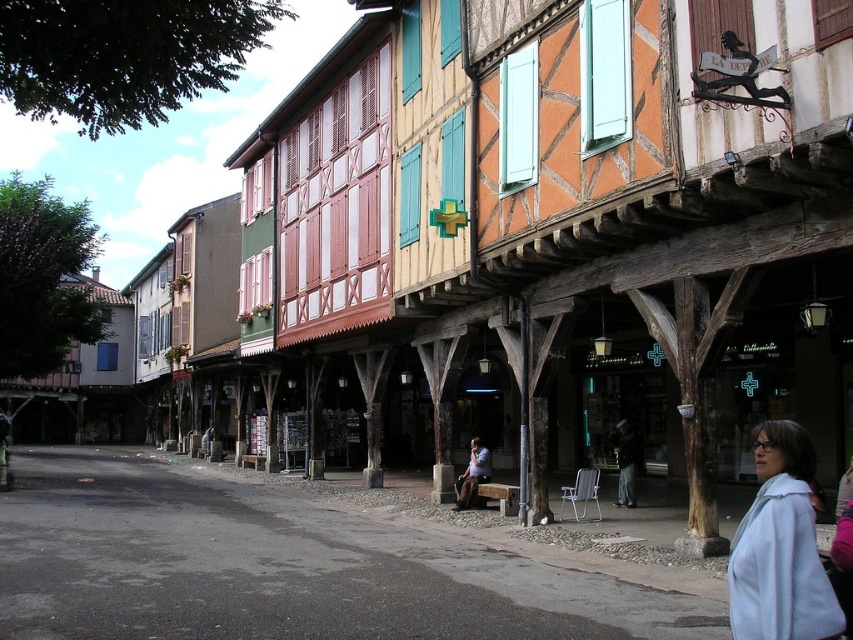
Does dark brown leather jacket at center have a greater height compared to denim jacket at center?

No.

This screenshot has width=853, height=640. I want to click on dark brown leather jacket at center, so click(624, 461).

From the picture: Which is above, light blue woolen coat at lower right or dark brown leather jacket at center?

light blue woolen coat at lower right is higher up.

Is point (799, 512) farther from viewer compared to point (627, 433)?

No, (799, 512) is closer to viewer.

Is point (804, 588) positioned behind point (625, 481)?

That is False.

Locate an element on the screen. The height and width of the screenshot is (640, 853). light blue woolen coat at lower right is located at coordinates (780, 547).

In the scene shown: Can you confirm if light blue woolen coat at lower right is smaller than denim jacket at center?

Yes, light blue woolen coat at lower right is smaller than denim jacket at center.

Who is more distant from viewer, (753, 513) or (473, 452)?

The point (473, 452) is more distant.

Find the location of a particular element. This screenshot has height=640, width=853. light blue woolen coat at lower right is located at coordinates (x=780, y=547).